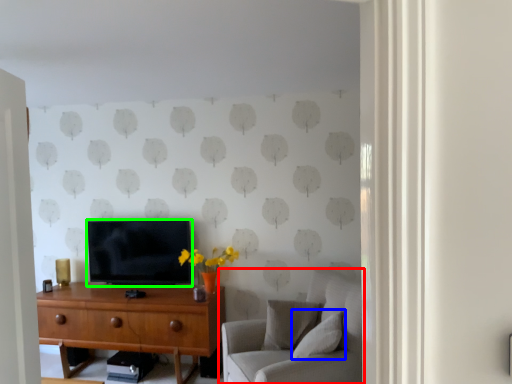
Question: Considering the real-world distances, which object is closest to studio couch (highlighted by a red box)? pillow (highlighted by a blue box) or television (highlighted by a green box).

Choices:
 (A) pillow
 (B) television

Answer: (A)